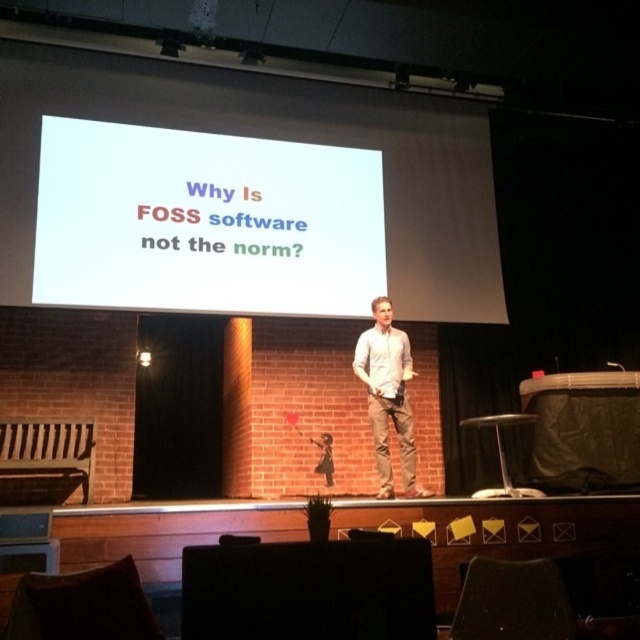
Who is higher up, white shirt at center or metallic silver stool at lower right?

white shirt at center

Which of these two, white shirt at center or metallic silver stool at lower right, stands shorter?

metallic silver stool at lower right is shorter.

Which is behind, point (362, 360) or point (461, 419)?

Positioned behind is point (461, 419).

Identify the location of white shirt at center. The height and width of the screenshot is (640, 640). point(388,396).

Does white matte projection screen at center appear on the left side of white shirt at center?

Indeed, white matte projection screen at center is positioned on the left side of white shirt at center.

Which is in front, point (308, 243) or point (397, 419)?

Point (397, 419)

Which is in front, point (244, 305) or point (385, 401)?

Positioned in front is point (385, 401).

Locate an element on the screen. Image resolution: width=640 pixels, height=640 pixels. white matte projection screen at center is located at coordinates (205, 221).

Which of these two, white matte projection screen at center or metallic silver stool at lower right, stands taller?

white matte projection screen at center is taller.

Which is below, white matte projection screen at center or metallic silver stool at lower right?

metallic silver stool at lower right is lower down.

Is point (90, 129) closer to viewer compared to point (464, 420)?

Yes.

Locate an element on the screen. white matte projection screen at center is located at coordinates (205, 221).